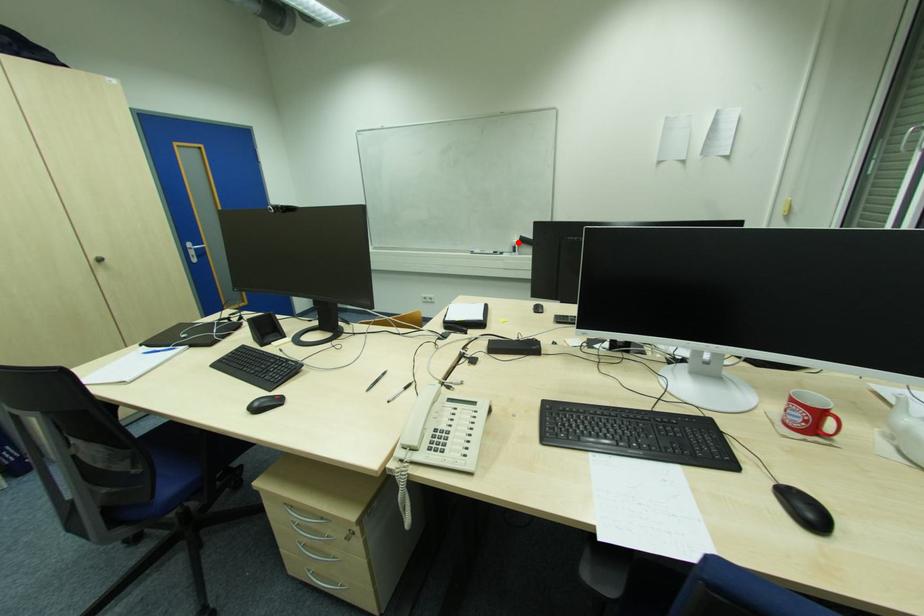
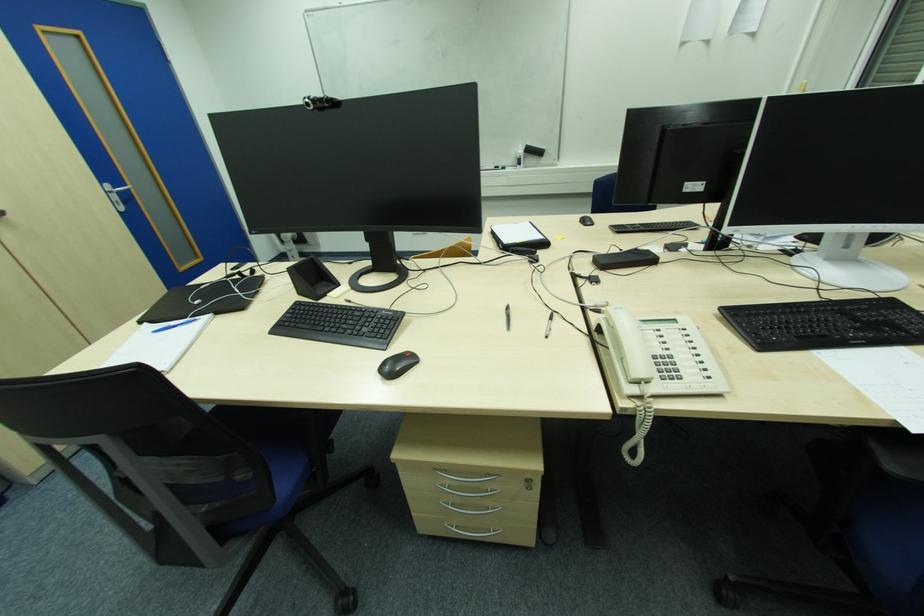
Find the pixel in the second image that matches the highlighted location in the first image.

(521, 153)